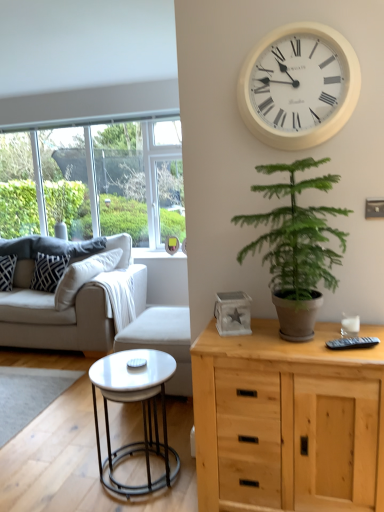
Where is `black plastic remote at right`? black plastic remote at right is located at coordinates (352, 343).

Describe the element at coordinates (94, 179) in the screenshot. Image resolution: width=384 pixels, height=512 pixels. I see `clear glass window at left` at that location.

This screenshot has width=384, height=512. Describe the element at coordinates (162, 341) in the screenshot. I see `white fabric armchair at center` at that location.

At what (x,y) coordinates should I click in order to perform the action: click on black plastic remote at right. Please return your answer as a coordinate pair (x, y). The height and width of the screenshot is (512, 384). Looking at the image, I should click on (352, 343).

From a real-world perspective, is black plastic remote at right physically located above or below green leafy plant at center-right?

From a real-world perspective, black plastic remote at right is physically below green leafy plant at center-right.

Can you tell me how much black plastic remote at right and green leafy plant at center-right differ in facing direction?

They differ by 164 degrees in their facing directions.

Is black plastic remote at right inside or outside of green leafy plant at center-right?

black plastic remote at right exists entirely within green leafy plant at center-right.

Identify the location of remote that appears below the green leafy plant at center-right (from a real-world perspective). (352, 343).

From the image's perspective, is black plastic remote at right located above black textured pillow at left, the 1th pillow when ordered from right to left?

No, from the image's perspective, black plastic remote at right is not on top of black textured pillow at left, the 1th pillow when ordered from right to left.

Considering the sizes of black plastic remote at right and black textured pillow at left, the 1th pillow when ordered from right to left, in the image, is black plastic remote at right bigger or smaller than black textured pillow at left, the 1th pillow when ordered from right to left,?

In the image, black plastic remote at right appears to be smaller than black textured pillow at left, the 1th pillow when ordered from right to left.

Consider the image. Which object is more forward, black plastic remote at right or black textured pillow at left, which is the second pillow from left to right?

black plastic remote at right.

Which point is more forward, (340, 344) or (59, 261)?

The point (340, 344) is in front.

Choose the correct answer: Is green leafy plant at center-right inside patterned fabric pillow at left, the 2th pillow from the right, or outside it?

green leafy plant at center-right is spatially situated outside patterned fabric pillow at left, the 2th pillow from the right.

Is green leafy plant at center-right far from patterned fabric pillow at left, the 2th pillow from the right?

Yes, green leafy plant at center-right is far from patterned fabric pillow at left, the 2th pillow from the right.

Is green leafy plant at center-right turned away from patterned fabric pillow at left, the 2th pillow from the right?

No, green leafy plant at center-right is not facing the opposite direction of patterned fabric pillow at left, the 2th pillow from the right.

Is green leafy plant at center-right at the right side of patterned fabric pillow at left, placed as the 1th pillow when sorted from left to right?

Indeed, green leafy plant at center-right is positioned on the right side of patterned fabric pillow at left, placed as the 1th pillow when sorted from left to right.

Which object is further away from the camera taking this photo, beige fabric couch at left or white plastic wall clock at upper center?

beige fabric couch at left is further away from the camera.

Based on their positions, is beige fabric couch at left located to the left or right of white plastic wall clock at upper center?

Clearly, beige fabric couch at left is on the left of white plastic wall clock at upper center in the image.

Is beige fabric couch at left in contact with white plastic wall clock at upper center?

No, beige fabric couch at left is not in contact with white plastic wall clock at upper center.

Is black plastic remote at right touching beige fabric couch at left?

No, black plastic remote at right is not making contact with beige fabric couch at left.

From a real-world perspective, which object stands above the other?

black plastic remote at right.

Visually, is black plastic remote at right positioned to the left or to the right of beige fabric couch at left?

In the image, black plastic remote at right appears on the right side of beige fabric couch at left.

Which object is thinner, natural wood cabinet at right or white fabric armchair at center?

With smaller width is natural wood cabinet at right.

Would you say natural wood cabinet at right is outside white fabric armchair at center?

Absolutely, natural wood cabinet at right is external to white fabric armchair at center.

Is natural wood cabinet at right taller or shorter than white fabric armchair at center?

natural wood cabinet at right is taller than white fabric armchair at center.

From the image's perspective, which object appears higher, natural wood cabinet at right or white fabric armchair at center?

white fabric armchair at center.

From a real-world perspective, which pillow is the 1st one above the white fabric armchair at center? Please provide its 2D coordinates.

[(7, 271)]

Does patterned fabric pillow at left, the 2th pillow from the right, have a lesser height compared to white fabric armchair at center?

Correct, patterned fabric pillow at left, the 2th pillow from the right, is not as tall as white fabric armchair at center.

Is patterned fabric pillow at left, placed as the 1th pillow when sorted from left to right, inside or outside of white fabric armchair at center?

patterned fabric pillow at left, placed as the 1th pillow when sorted from left to right, is not enclosed by white fabric armchair at center.

Is patterned fabric pillow at left, placed as the 1th pillow when sorted from left to right, to the left or to the right of white fabric armchair at center in the image?

patterned fabric pillow at left, placed as the 1th pillow when sorted from left to right, is positioned on white fabric armchair at center's left side.

Where is `remote behind the green leafy plant at center-right`? remote behind the green leafy plant at center-right is located at coordinates (352, 343).

This screenshot has height=512, width=384. Find the location of `remote above the black textured pillow at left, which is the second pillow from left to right (from a real-world perspective)`. remote above the black textured pillow at left, which is the second pillow from left to right (from a real-world perspective) is located at coordinates (352, 343).

Looking at the image, which one is located closer to natural wood cabinet at right, white plastic wall clock at upper center or beige fabric couch at left?

The object closer to natural wood cabinet at right is white plastic wall clock at upper center.

Considering their positions, is beige fabric couch at left positioned closer to black plastic remote at right than natural wood cabinet at right?

natural wood cabinet at right is positioned closer to the anchor black plastic remote at right.

Based on their spatial positions, is green leafy plant at center-right or white plastic wall clock at upper center further from black textured pillow at left, which is the second pillow from left to right?

The object further to black textured pillow at left, which is the second pillow from left to right, is white plastic wall clock at upper center.

Looking at the image, which one is located further to black textured pillow at left, which is the second pillow from left to right, natural wood cabinet at right or green leafy plant at center-right?

natural wood cabinet at right is further to black textured pillow at left, which is the second pillow from left to right.

Which object lies further to the anchor point beige fabric couch at left, patterned fabric pillow at left, placed as the 1th pillow when sorted from left to right, or white glossy coffee table at lower left?

Among the two, white glossy coffee table at lower left is located further to beige fabric couch at left.

Based on the photo, which object lies further to the anchor point natural wood cabinet at right, clear glass window at left or white fabric armchair at center?

clear glass window at left is further to natural wood cabinet at right.

Consider the image. Looking at the image, which one is located further to patterned fabric pillow at left, placed as the 1th pillow when sorted from left to right, beige fabric couch at left or clear glass window at left?

Among the two, clear glass window at left is located further to patterned fabric pillow at left, placed as the 1th pillow when sorted from left to right.

When comparing their distances from natural wood cabinet at right, does beige fabric couch at left or clear glass window at left seem closer?

beige fabric couch at left is positioned closer to the anchor natural wood cabinet at right.

Locate an element on the screen. studio couch located between white glossy coffee table at lower left and patterned fabric pillow at left, placed as the 1th pillow when sorted from left to right, in the depth direction is located at coordinates (53, 317).

Identify the location of wall clock positioned between green leafy plant at center-right and patterned fabric pillow at left, the 2th pillow from the right, from near to far. The image size is (384, 512). (299, 86).

You are a GUI agent. You are given a task and a screenshot of the screen. Output one action in this format:
    pyautogui.click(x=<x>, y=<y>)
    Task: Click on the armchair between beige fabric couch at left and black plastic remote at right in the horizontal direction
    The image size is (384, 512).
    Given the screenshot: What is the action you would take?
    pyautogui.click(x=162, y=341)

Locate an element on the screen. The image size is (384, 512). armchair between white glossy coffee table at lower left and black textured pillow at left, which is the second pillow from left to right, along the z-axis is located at coordinates (162, 341).